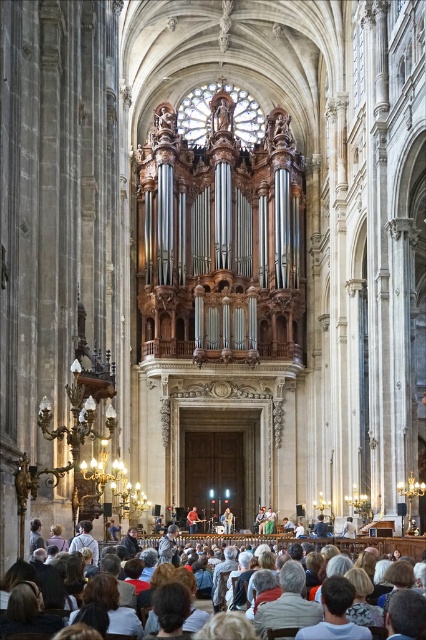
Question: Which point is closer to the camera taking this photo?

Choices:
 (A) (233, 544)
 (B) (198, 516)

Answer: (A)

Question: Can you confirm if light brown wooden chairs at lower center is thinner than red shirt at lower center?

Choices:
 (A) yes
 (B) no

Answer: (B)

Question: Considering the relative positions of light brown wooden chairs at lower center and red shirt at lower center in the image provided, where is light brown wooden chairs at lower center located with respect to red shirt at lower center?

Choices:
 (A) left
 (B) right

Answer: (B)

Question: Which of the following is the farthest from the observer?

Choices:
 (A) (187, 522)
 (B) (382, 538)

Answer: (A)

Question: Is light brown wooden chairs at lower center further to the viewer compared to red shirt at lower center?

Choices:
 (A) no
 (B) yes

Answer: (A)